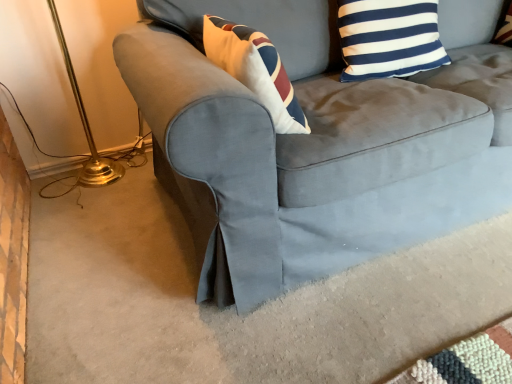
This screenshot has height=384, width=512. In order to click on suede gray couch at lower right in this screenshot , I will do `click(302, 152)`.

What do you see at coordinates (302, 152) in the screenshot?
I see `suede gray couch at lower right` at bounding box center [302, 152].

What do you see at coordinates (389, 38) in the screenshot? The image size is (512, 384). I see `blue and white striped pillow at upper right` at bounding box center [389, 38].

What is the approximate width of blue and white striped pillow at upper right?

8.01 inches.

The width and height of the screenshot is (512, 384). Identify the location of blue and white striped pillow at upper right. (389, 38).

The width and height of the screenshot is (512, 384). I want to click on suede gray couch at lower right, so click(302, 152).

Does blue and white striped pillow at upper right appear on the left side of suede gray couch at lower right?

Correct, you'll find blue and white striped pillow at upper right to the left of suede gray couch at lower right.

Which object is further away from the camera, blue and white striped pillow at upper right or suede gray couch at lower right?

blue and white striped pillow at upper right is further away from the camera.

Considering the points (384, 62) and (305, 257), which point is behind, point (384, 62) or point (305, 257)?

Positioned behind is point (384, 62).

From the image's perspective, is blue and white striped pillow at upper right on suede gray couch at lower right?

Correct, blue and white striped pillow at upper right appears higher than suede gray couch at lower right in the image.

From a real-world perspective, is blue and white striped pillow at upper right positioned under suede gray couch at lower right based on gravity?

Actually, blue and white striped pillow at upper right is physically above suede gray couch at lower right in the real world.

Which of these two, blue and white striped pillow at upper right or suede gray couch at lower right, is wider?

Wider between the two is suede gray couch at lower right.

Considering the sizes of blue and white striped pillow at upper right and suede gray couch at lower right in the image, is blue and white striped pillow at upper right taller or shorter than suede gray couch at lower right?

In the image, blue and white striped pillow at upper right appears to be shorter than suede gray couch at lower right.

Considering the sizes of objects blue and white striped pillow at upper right and suede gray couch at lower right in the image provided, who is smaller, blue and white striped pillow at upper right or suede gray couch at lower right?

Smaller between the two is blue and white striped pillow at upper right.

Is blue and white striped pillow at upper right not inside suede gray couch at lower right?

No.

Would you consider blue and white striped pillow at upper right to be distant from suede gray couch at lower right?

No, blue and white striped pillow at upper right is in close proximity to suede gray couch at lower right.

Is blue and white striped pillow at upper right aimed at suede gray couch at lower right?

Yes, blue and white striped pillow at upper right is oriented towards suede gray couch at lower right.

Image resolution: width=512 pixels, height=384 pixels. In order to click on studio couch beneath the blue and white striped pillow at upper right (from a real-world perspective) in this screenshot , I will do `click(302, 152)`.

Visually, is suede gray couch at lower right positioned to the left or to the right of blue and white striped pillow at upper right?

In the image, suede gray couch at lower right appears on the right side of blue and white striped pillow at upper right.

From the picture: In the image, is suede gray couch at lower right positioned in front of or behind blue and white striped pillow at upper right?

suede gray couch at lower right is positioned closer to the viewer than blue and white striped pillow at upper right.

Is point (296, 69) behind point (429, 23)?

That is True.

From the image's perspective, which one is positioned higher, suede gray couch at lower right or blue and white striped pillow at upper right?

blue and white striped pillow at upper right appears higher in the image.

From a real-world perspective, relative to blue and white striped pillow at upper right, is suede gray couch at lower right vertically above or below?

suede gray couch at lower right is situated lower than blue and white striped pillow at upper right in the real world.

Considering the relative sizes of suede gray couch at lower right and blue and white striped pillow at upper right in the image provided, is suede gray couch at lower right thinner than blue and white striped pillow at upper right?

No.

From the picture: Which of these two, suede gray couch at lower right or blue and white striped pillow at upper right, stands taller?

With more height is suede gray couch at lower right.

Between suede gray couch at lower right and blue and white striped pillow at upper right, which one has smaller size?

blue and white striped pillow at upper right is smaller.

From the picture: Is suede gray couch at lower right not inside blue and white striped pillow at upper right?

suede gray couch at lower right lies outside blue and white striped pillow at upper right's area.

Does suede gray couch at lower right touch blue and white striped pillow at upper right?

There is a gap between suede gray couch at lower right and blue and white striped pillow at upper right.

Could you tell me if suede gray couch at lower right is turned towards blue and white striped pillow at upper right?

Yes, suede gray couch at lower right is facing blue and white striped pillow at upper right.

How different are the orientations of suede gray couch at lower right and blue and white striped pillow at upper right in degrees?

They differ by 0.0818 degrees in their facing directions.

Measure the distance from suede gray couch at lower right to blue and white striped pillow at upper right.

12.82 inches.

This screenshot has height=384, width=512. I want to click on pillow that appears on the left of suede gray couch at lower right, so click(389, 38).

What are the coordinates of `pillow located above the suede gray couch at lower right (from a real-world perspective)` in the screenshot? It's located at (389, 38).

What are the coordinates of `studio couch located on the right of blue and white striped pillow at upper right` in the screenshot? It's located at (302, 152).